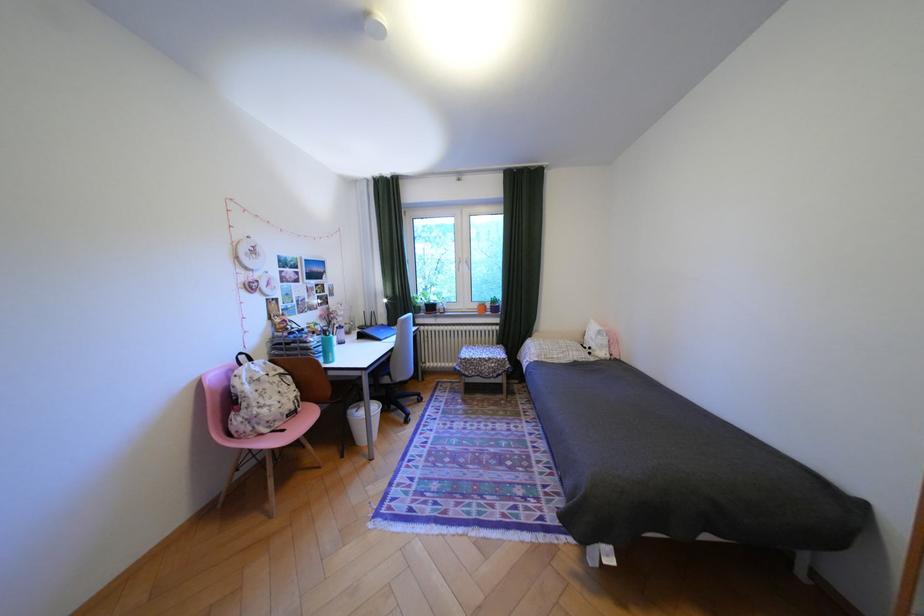
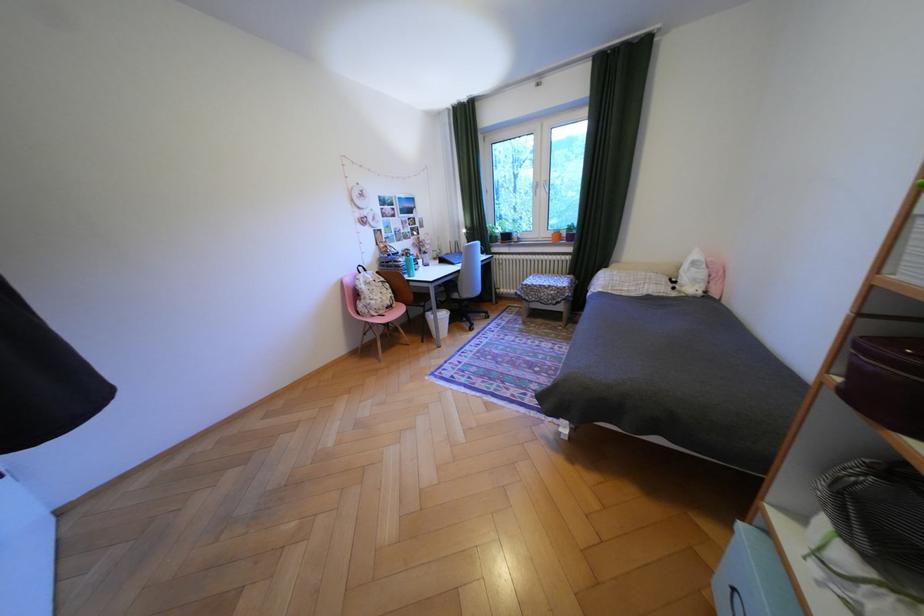
Locate, in the second image, the point that corresponds to (322,339) in the first image.

(411, 259)